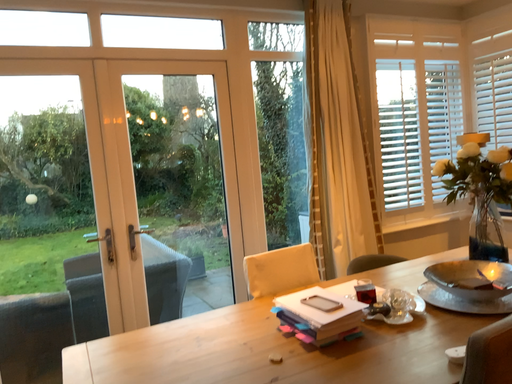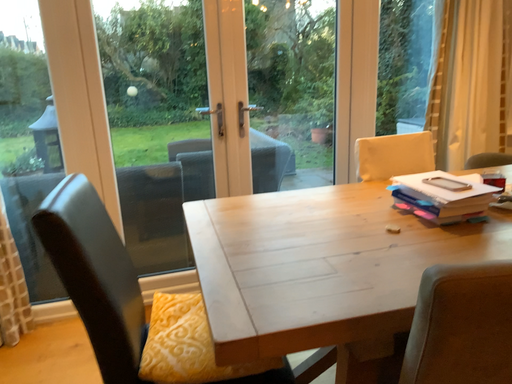
Question: How did the camera likely rotate when shooting the video?

Choices:
 (A) rotated right
 (B) rotated left

Answer: (B)